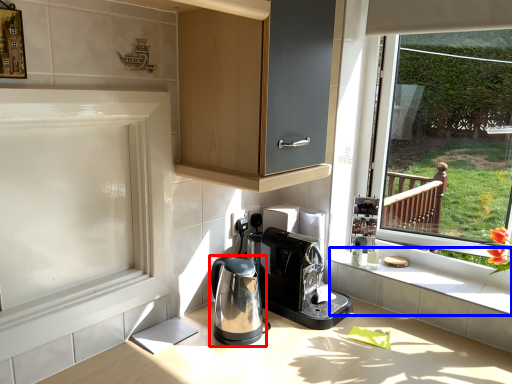
Question: Which object is further to the camera taking this photo, home appliance (highlighted by a red box) or window sill (highlighted by a blue box)?

Choices:
 (A) home appliance
 (B) window sill

Answer: (B)